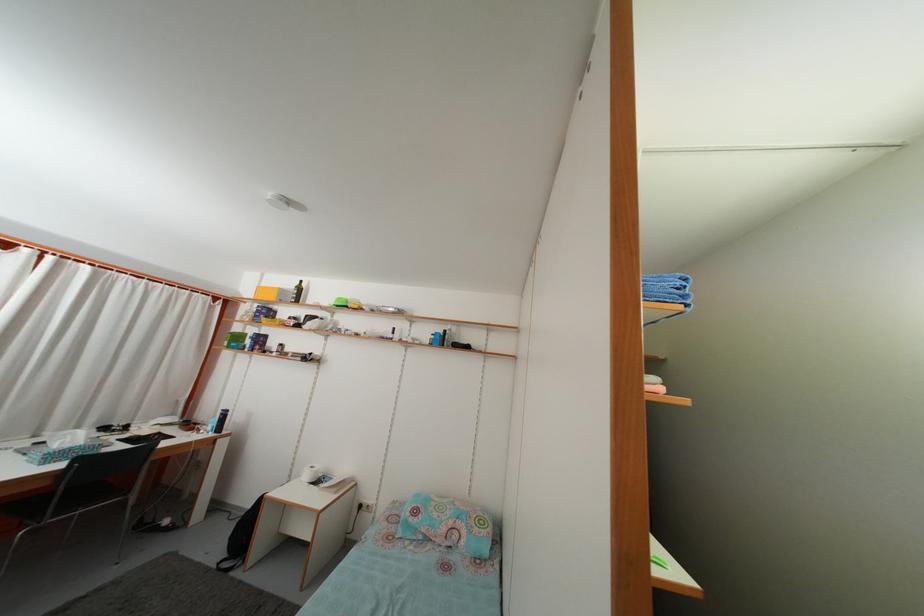
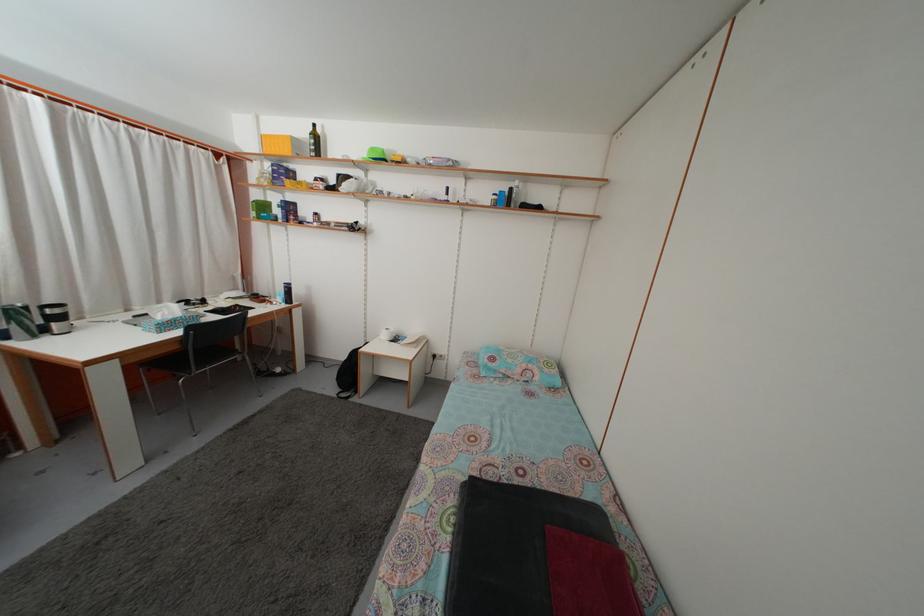
Question: Based on the continuous images, in which direction is the camera rotating? Reply with the corresponding letter.

Choices:
 (A) Left
 (B) Right
 (C) Up
 (D) Down

Answer: (D)